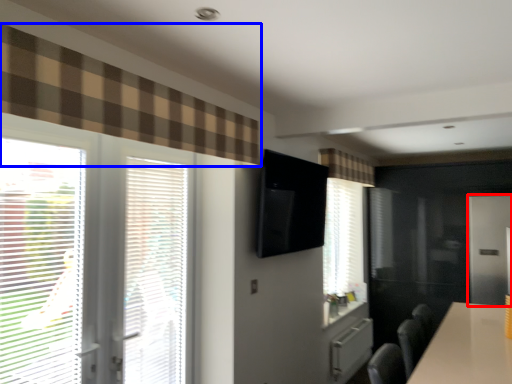
Question: Which object is further to the camera taking this photo, screen door (highlighted by a red box) or curtain (highlighted by a blue box)?

Choices:
 (A) screen door
 (B) curtain

Answer: (A)